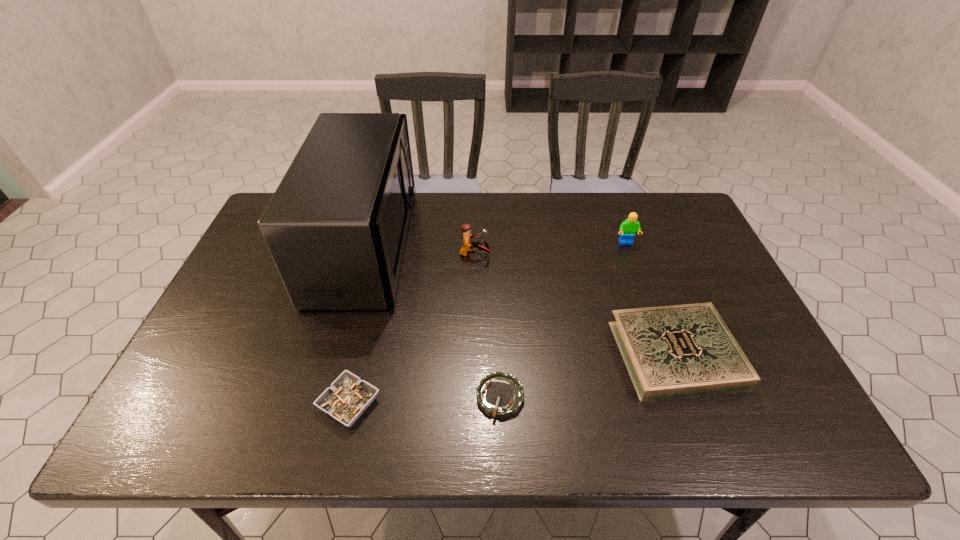
Where is `free spot at the near right corner of the desktop`? free spot at the near right corner of the desktop is located at coordinates (808, 444).

Locate an element on the screen. The image size is (960, 540). empty space that is in between the left Lego and the right ashtray is located at coordinates (488, 326).

At what (x,y) coordinates should I click in order to perform the action: click on empty space between the left Lego and the left ashtray. Please return your answer as a coordinate pair (x, y). Looking at the image, I should click on (412, 329).

The height and width of the screenshot is (540, 960). In order to click on vacant area between the right Lego and the shorter ashtray in this screenshot , I will do `click(564, 320)`.

Where is `vacant point located between the microwave_oven and the left Lego`? The width and height of the screenshot is (960, 540). vacant point located between the microwave_oven and the left Lego is located at coordinates (420, 249).

At what (x,y) coordinates should I click in order to perform the action: click on free area in between the tallest object and the right Lego. Please return your answer as a coordinate pair (x, y). Looking at the image, I should click on (495, 244).

The width and height of the screenshot is (960, 540). Find the location of `free space between the shorter ashtray and the right Lego`. free space between the shorter ashtray and the right Lego is located at coordinates (564, 320).

This screenshot has width=960, height=540. What are the coordinates of `empty space between the right Lego and the second shortest object` in the screenshot? It's located at (488, 323).

This screenshot has width=960, height=540. I want to click on vacant region between the tallest object and the left Lego, so click(x=420, y=249).

This screenshot has height=540, width=960. What are the coordinates of `empty location between the left Lego and the taller ashtray` in the screenshot? It's located at (412, 329).